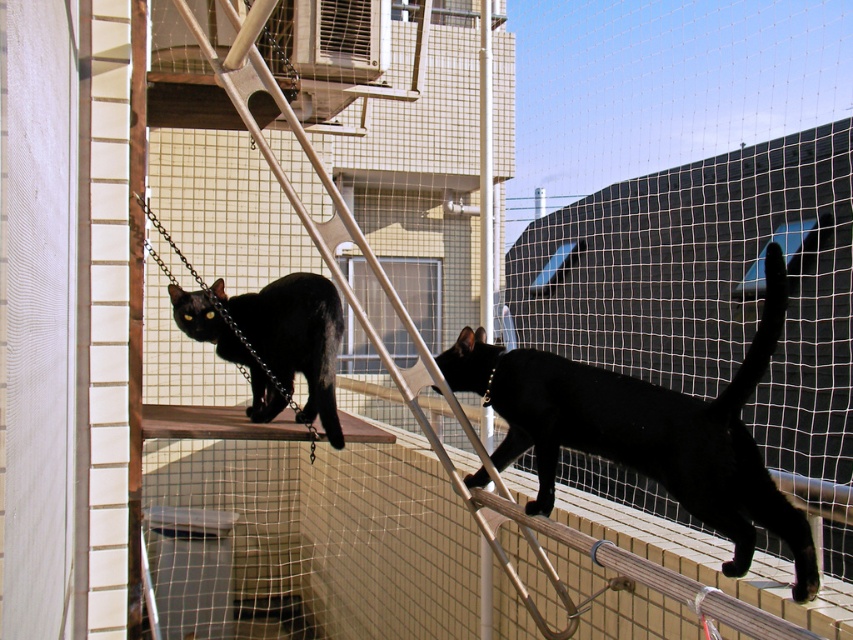
You are a photographer trying to capture both cats in a single frame. Given that your camera can only focus on objects within a 1.2 meter width, will the black glossy cat at upper right and the matte black cat at upper left fit side by side without overlapping?

The black glossy cat at upper right is wider than the matte black cat at upper left. However, since the total width of both cats combined is not provided, it is impossible to determine if they can fit within the 1.2 meter width requirement without overlapping.

You are a photographer trying to capture both cats in a single shot. Given their positions, which cat, the black glossy cat at upper right or the matte black cat at upper left, would be easier to focus on due to its height?

The black glossy cat at upper right is much taller than the matte black cat at upper left, making it easier to focus on due to its height.

You are a photographer aiming to capture both cats in a single shot without moving the camera. Since the black glossy cat at upper right is larger in the frame, will it appear closer to the camera than the matte black cat at upper left?

Yes, the black glossy cat at upper right will appear closer to the camera than the matte black cat at upper left because it is larger in size.